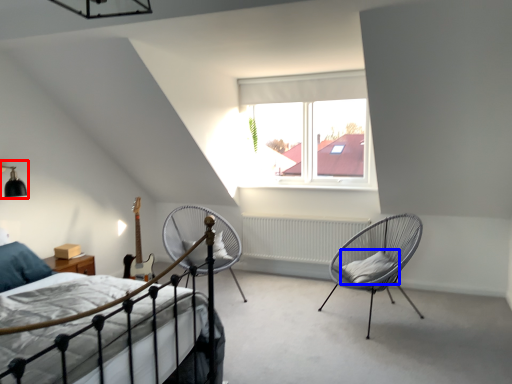
Question: Among these objects, which one is nearest to the camera, light fixture (highlighted by a red box) or pillow (highlighted by a blue box)?

Choices:
 (A) light fixture
 (B) pillow

Answer: (A)